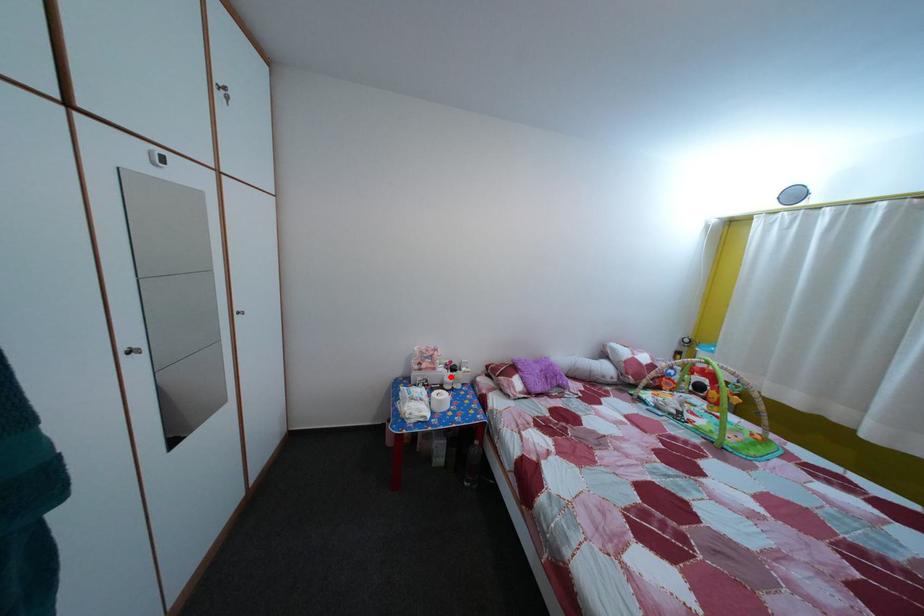
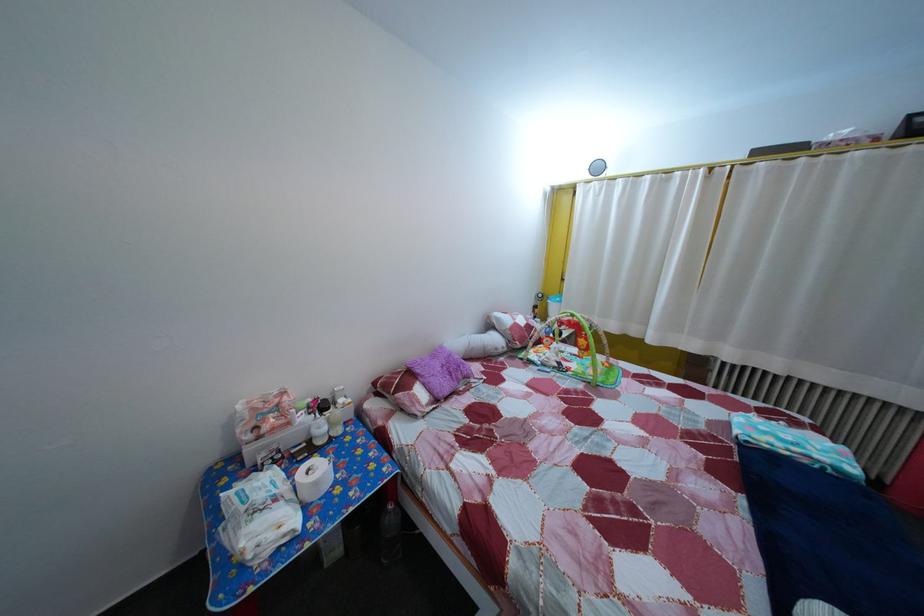
Question: I am providing you with two images of the same scene from different viewpoints. Given a red point in image1, look at the same physical point in image2. Is it:

Choices:
 (A) Closer to the viewpoint
 (B) Farther from the viewpoint

Answer: (A)